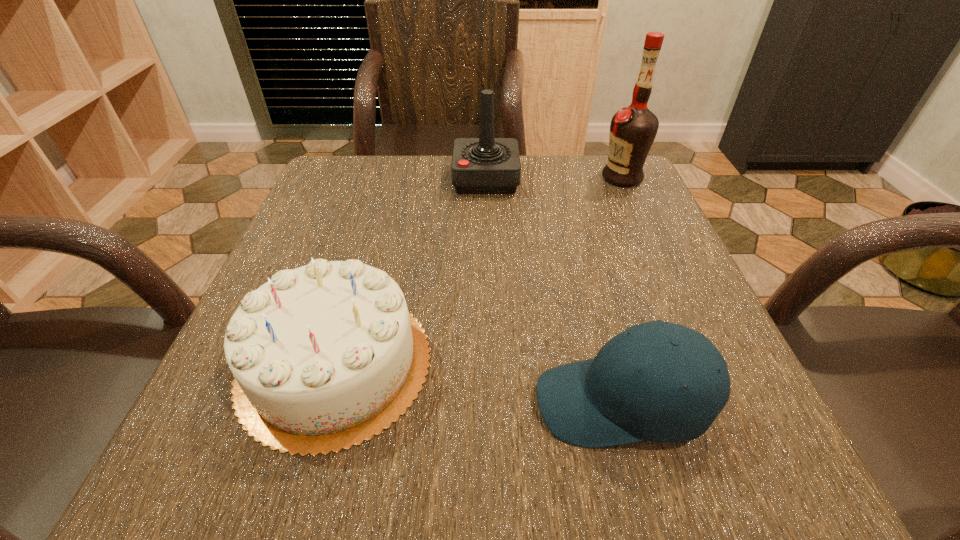
Identify the location of free space located on the front-facing side of the joystick. (428, 179).

At what (x,y) coordinates should I click in order to perform the action: click on vacant position located 0.070m on the back of the leftmost object. Please return your answer as a coordinate pair (x, y). Looking at the image, I should click on (362, 268).

Identify the location of vacant space positioned on the front-facing side of the shortest object. This screenshot has height=540, width=960. (283, 403).

Find the location of a particular element. The image size is (960, 540). vacant space located 0.180m on the front-facing side of the shortest object is located at coordinates (x=406, y=403).

Where is `blank space located on the front-facing side of the shortest object`? The height and width of the screenshot is (540, 960). blank space located on the front-facing side of the shortest object is located at coordinates (464, 403).

This screenshot has height=540, width=960. I want to click on liquor that is at the far edge, so click(633, 129).

Locate an element on the screen. The height and width of the screenshot is (540, 960). joystick that is at the far edge is located at coordinates (486, 165).

You are a GUI agent. You are given a task and a screenshot of the screen. Output one action in this format:
    pyautogui.click(x=<x>, y=<y>)
    Task: Click on the birthday cake that is positioned at the near edge
    The height and width of the screenshot is (540, 960).
    Given the screenshot: What is the action you would take?
    pyautogui.click(x=325, y=356)

Locate an element on the screen. This screenshot has height=540, width=960. baseball cap that is at the near edge is located at coordinates coord(605,401).

Where is `object that is positioned at the left edge`? This screenshot has height=540, width=960. object that is positioned at the left edge is located at coordinates (325, 356).